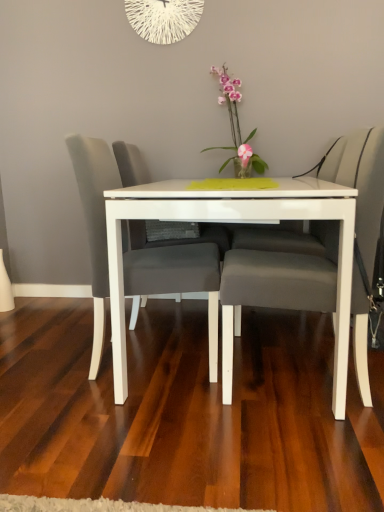
Where is `free point in front of matte gray cushioned chair at center, the 1th chair from the right`? Image resolution: width=384 pixels, height=512 pixels. free point in front of matte gray cushioned chair at center, the 1th chair from the right is located at coordinates (288, 454).